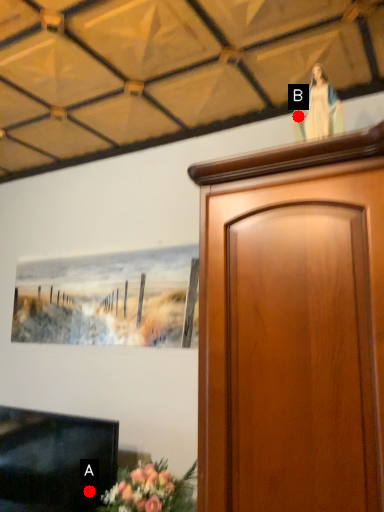
Question: Two points are circled on the image, labeled by A and B beside each circle. Among these points, which one is nearest to the camera?

Choices:
 (A) A is closer
 (B) B is closer

Answer: (B)